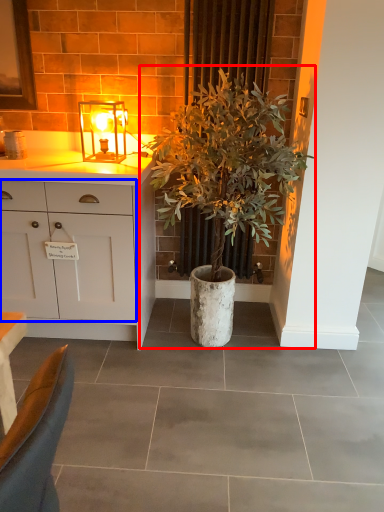
Question: Among these objects, which one is farthest to the camera, houseplant (highlighted by a red box) or cabinetry (highlighted by a blue box)?

Choices:
 (A) houseplant
 (B) cabinetry

Answer: (B)